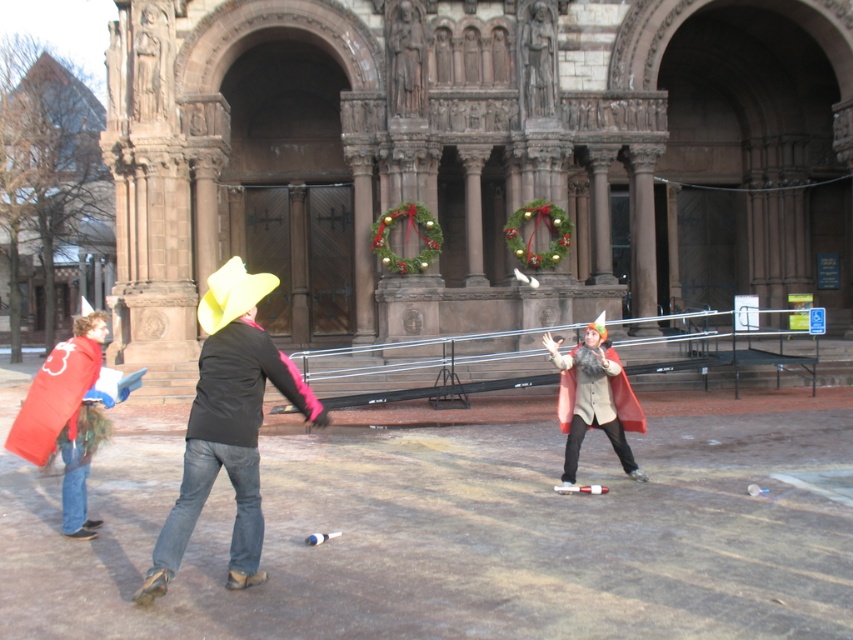
Question: In this image, where is denim jeans at center located relative to velvet red cape at center?

Choices:
 (A) above
 (B) below

Answer: (A)

Question: Can you confirm if denim jeans at center is wider than velvet red cape at center?

Choices:
 (A) no
 (B) yes

Answer: (B)

Question: Which point is farther to the camera?

Choices:
 (A) denim jeans at center
 (B) velvet red cape at center

Answer: (B)

Question: Does denim jeans at center come behind velvet red cape at center?

Choices:
 (A) no
 (B) yes

Answer: (A)